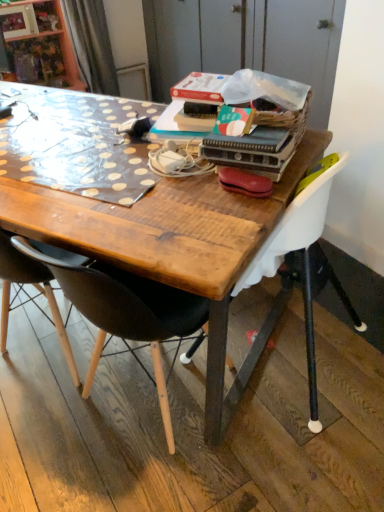
Where is `blank space to the left of leather-like brown handbag at center`? This screenshot has width=384, height=512. blank space to the left of leather-like brown handbag at center is located at coordinates (178, 196).